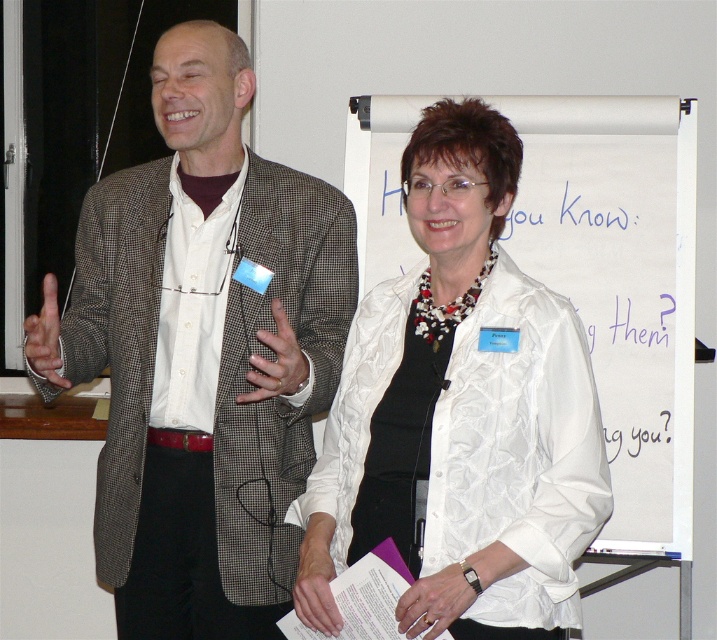
Based on the scene description, which object is taller between the checkered fabric blazer at left and the white satin lab coat at center?

The checkered fabric blazer at left is taller than the white satin lab coat at center according to the description.

You are a healthcare professional entering a sterile room and see the white satin lab coat at center and the white fabric at center. Which item should you put on first according to standard protocols?

The white satin lab coat at center should be put on first because it is taller than the white fabric at center, ensuring proper coverage during the process.

You are an event organizer setting up a stage for a presentation. You notice two white items on the stage. One is the white fabric at upper center and the other is the white satin lab coat at center. Which of these two items is located more to the right?

The white fabric at upper center is positioned on the right side of the white satin lab coat at center, so the white fabric at upper center is more to the right.